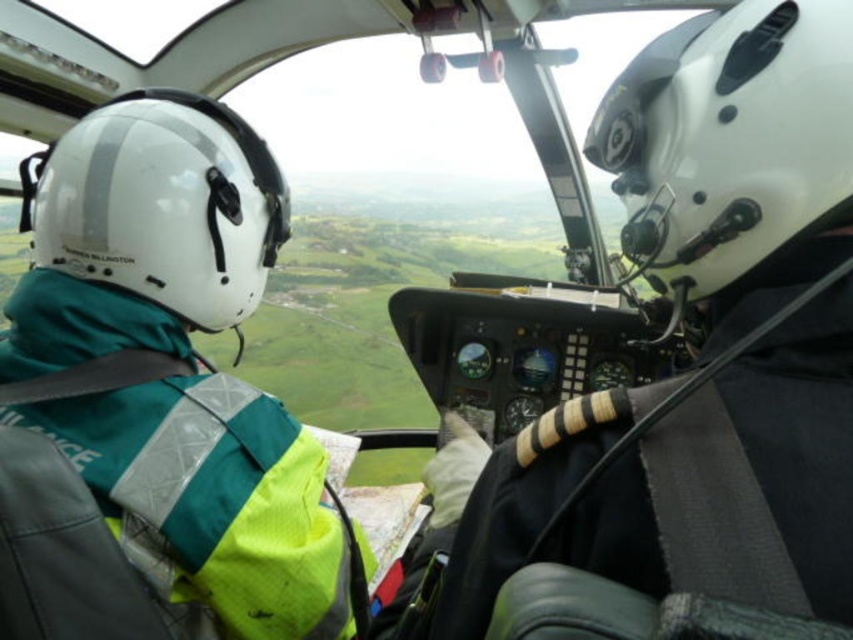
You are a passenger in the helicopter and need to identify the pilot and co pilot based on their helmets. Which helmet is lower in height, the white matte helmet at center or the white matte helmet at left?

The white matte helmet at center has a lesser height compared to the white matte helmet at left, so the white matte helmet at center is lower in height.

Looking at this image, you are a passenger in the helicopter and want to take a photo of the point at coordinates (x=732, y=184). The camera you have can only focus on objects within 30 inches. Based on the scene description, will the camera be able to capture the point clearly?

The point at coordinates (x=732, y=184) is 32.36 inches away from the camera, which is beyond the camera focus range of 30 inches. Therefore, the camera will not be able to capture the point clearly.

You are a passenger in the helicopter and need to determine which object is taller between the green fabric jacket at upper left and the white matte helmet at left. Based on the scene, which one is taller?

The green fabric jacket at upper left is taller than the white matte helmet at left according to the description.